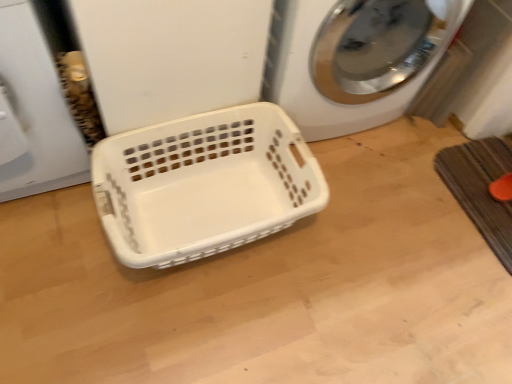
I want to click on free space in front of white plastic basket at center, so click(x=185, y=331).